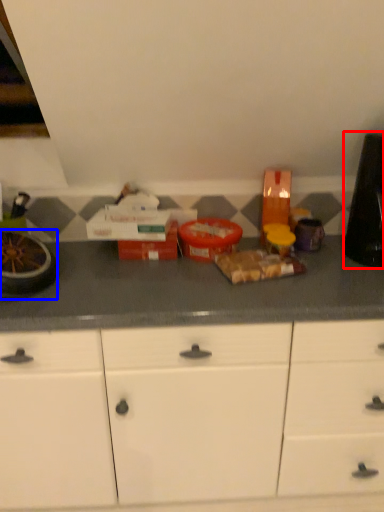
Question: Among these objects, which one is farthest to the camera, appliance (highlighted by a red box) or appliance (highlighted by a blue box)?

Choices:
 (A) appliance
 (B) appliance

Answer: (A)